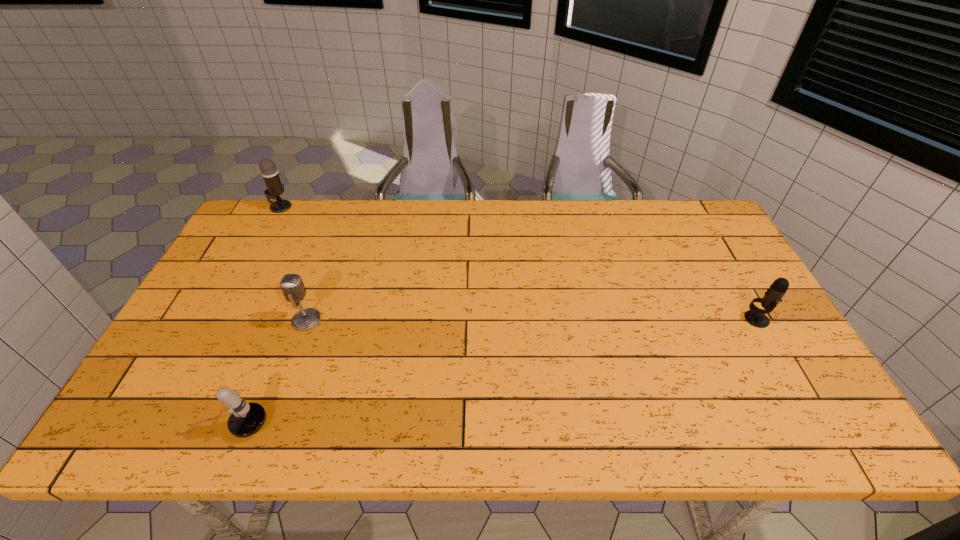
Identify the location of the leftmost object. (275, 187).

Where is `the farthest microphone`? The image size is (960, 540). the farthest microphone is located at coordinates click(x=275, y=187).

This screenshot has width=960, height=540. I want to click on the rightmost object, so click(x=755, y=316).

Locate an element on the screen. the nearest object is located at coordinates tap(246, 419).

You are a GUI agent. You are given a task and a screenshot of the screen. Output one action in this format:
    pyautogui.click(x=<x>, y=<y>)
    Task: Click on the vacant space located 0.290m on the right of the farthest object
    Image resolution: width=960 pixels, height=540 pixels.
    Given the screenshot: What is the action you would take?
    pyautogui.click(x=373, y=207)

The width and height of the screenshot is (960, 540). I want to click on free location located 0.300m on the back of the rightmost microphone, so click(711, 240).

Image resolution: width=960 pixels, height=540 pixels. I want to click on vacant area situated on the right of the nearest object, so click(304, 425).

You are a GUI agent. You are given a task and a screenshot of the screen. Output one action in this format:
    pyautogui.click(x=<x>, y=<y>)
    Task: Click on the object that is at the far edge
    
    Given the screenshot: What is the action you would take?
    pyautogui.click(x=275, y=187)

Where is `object situated at the near edge`? This screenshot has width=960, height=540. object situated at the near edge is located at coordinates (246, 419).

This screenshot has width=960, height=540. What are the coordinates of `object located in the right edge section of the desktop` in the screenshot? It's located at (755, 316).